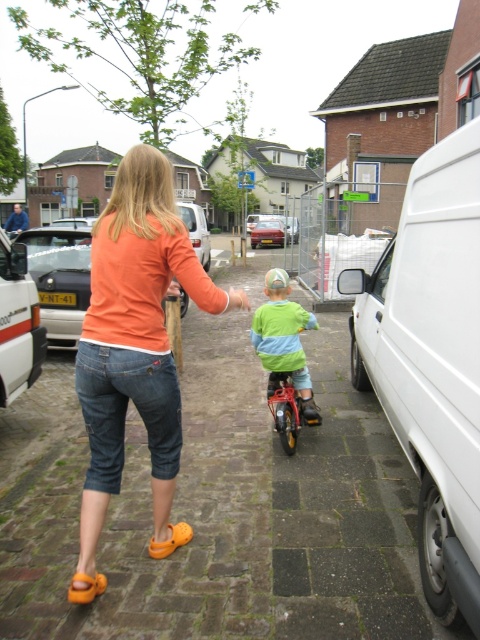
Question: Can you confirm if white matte van at right is thinner than matte white van at center?

Choices:
 (A) no
 (B) yes

Answer: (B)

Question: Which object appears closest to the camera in this image?

Choices:
 (A) white matte van at left
 (B) light green jersey at center
 (C) white matte van at right
 (D) matte white van at center

Answer: (C)

Question: Which of the following is the closest to the observer?

Choices:
 (A) (259, 227)
 (B) (64, 273)

Answer: (B)

Question: Which object is the farthest from the light green jersey at center?

Choices:
 (A) metallic red car at center
 (B) metallic red bicycle at center
 (C) orange cotton shirt at center
 (D) white matte van at left

Answer: (A)

Question: Is metallic red bicycle at center to the left of metallic red car at center from the viewer's perspective?

Choices:
 (A) yes
 (B) no

Answer: (B)

Question: In this image, where is orange cotton shirt at center located relative to light green jersey at center?

Choices:
 (A) left
 (B) right

Answer: (A)